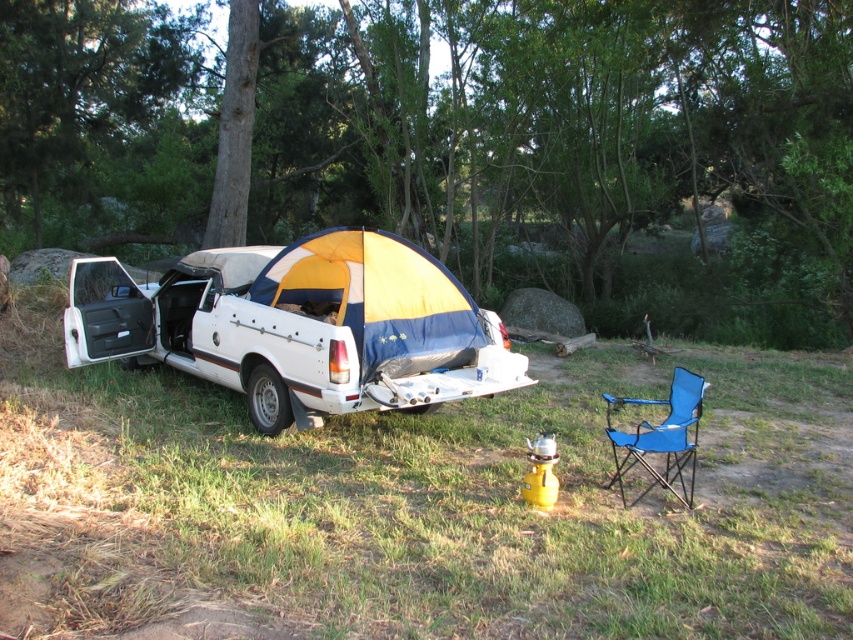
Question: Which point is farther to the camera?

Choices:
 (A) green leafy tree at upper center
 (B) white matte car at center

Answer: (A)

Question: Is green leafy tree at upper center positioned in front of white matte car at center?

Choices:
 (A) no
 (B) yes

Answer: (A)

Question: Which object is farther from the camera taking this photo?

Choices:
 (A) green leafy tree at upper center
 (B) white matte car at center

Answer: (A)

Question: Is green leafy tree at upper center below white matte car at center?

Choices:
 (A) yes
 (B) no

Answer: (B)

Question: Which object is closer to the camera taking this photo?

Choices:
 (A) green leafy tree at upper center
 (B) white matte car at center

Answer: (B)

Question: Does green leafy tree at upper center appear on the right side of white matte car at center?

Choices:
 (A) no
 (B) yes

Answer: (B)